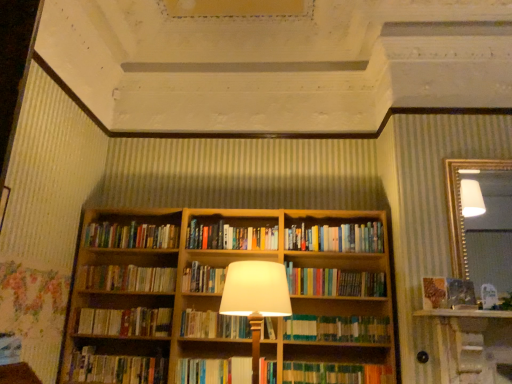
Where is `blank space situated above multicolored hardcover books at center, which is the third book from top to bottom (from a real-world perspective)`? Image resolution: width=512 pixels, height=384 pixels. blank space situated above multicolored hardcover books at center, which is the third book from top to bottom (from a real-world perspective) is located at coordinates (333, 216).